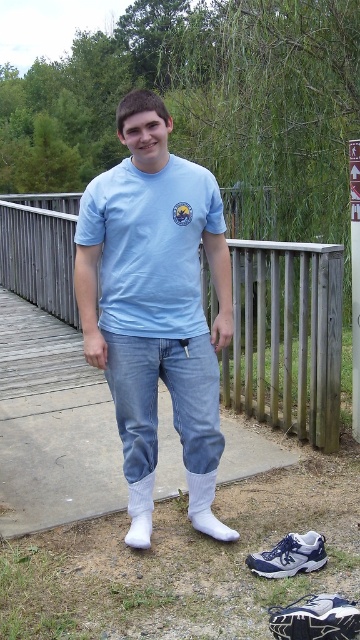
Question: Is blue denim jeans at center further to the viewer compared to white fabric sock at lower center?

Choices:
 (A) no
 (B) yes

Answer: (B)

Question: Is white cotton socks at lower center below blue denim jeans at center?

Choices:
 (A) no
 (B) yes

Answer: (B)

Question: Based on their relative distances, which object is farther from the blue mesh sneaker at lower right?

Choices:
 (A) white cotton sock at lower center
 (B) white fabric sock at lower center

Answer: (A)

Question: Which point is closer to the camera?

Choices:
 (A) blue mesh sneaker at lower right
 (B) white fabric sock at lower center
 (C) white mesh shoe at lower right
 (D) white cotton socks at lower center

Answer: (C)

Question: Among these objects, which one is nearest to the camera?

Choices:
 (A) white cotton sock at lower center
 (B) white cotton socks at lower center
 (C) blue mesh sneaker at lower right

Answer: (B)

Question: Observing the image, what is the correct spatial positioning of light blue cotton t-shirt at center in reference to white cotton sock at lower center?

Choices:
 (A) above
 (B) below

Answer: (A)